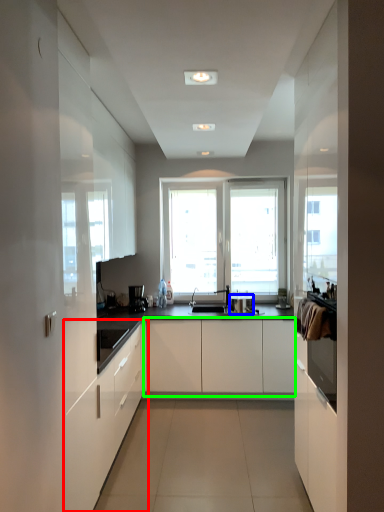
Question: Which is nearer to the cabinetry (highlighted by a red box)? appliance (highlighted by a blue box) or cabinetry (highlighted by a green box).

Choices:
 (A) appliance
 (B) cabinetry

Answer: (B)